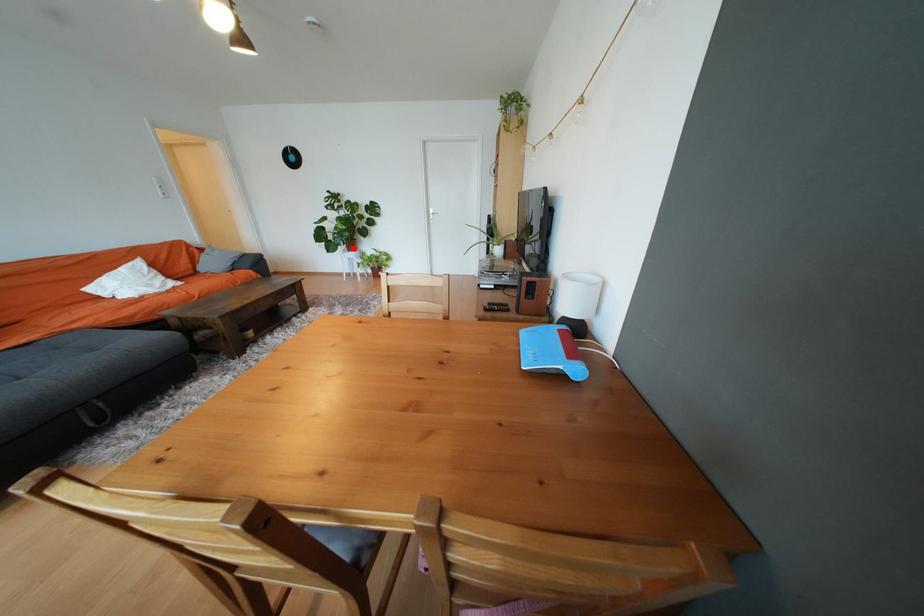
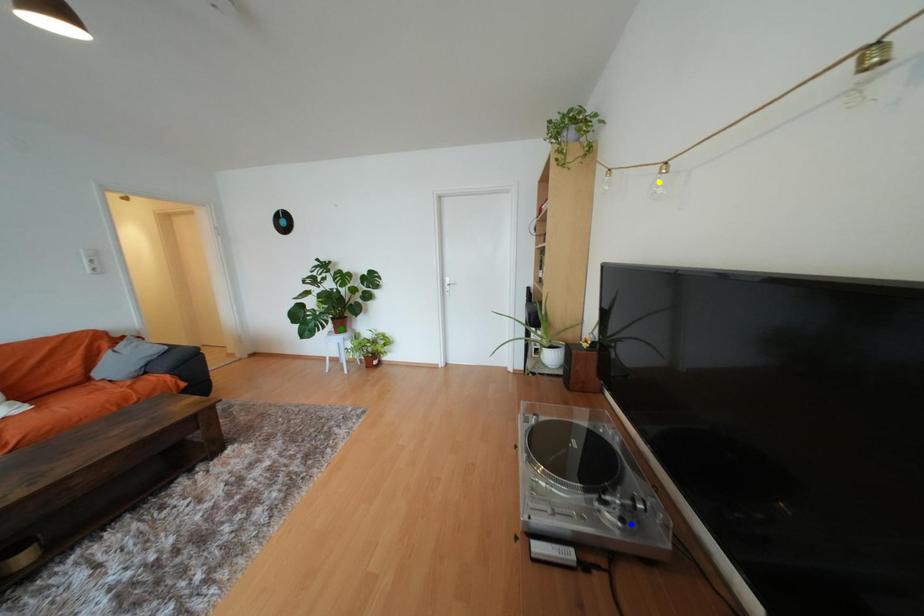
Question: I am providing you with two images of the same scene from different viewpoints. A red point is marked on the first image. You are given multiple points on the second image. In image 2, which mark is for the same physical point as the one in image 1?

Choices:
 (A) yellow point
 (B) blue point
 (C) green point

Answer: (C)